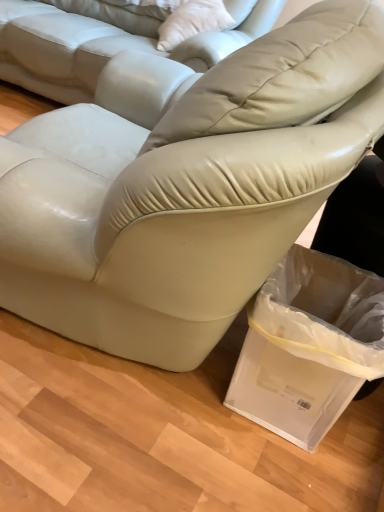
You are a GUI agent. You are given a task and a screenshot of the screen. Output one action in this format:
    pyautogui.click(x=<x>, y=<y>)
    Task: Click on the space that is in front of clear plastic bag at lower right
    The height and width of the screenshot is (512, 384).
    Given the screenshot: What is the action you would take?
    pyautogui.click(x=284, y=484)